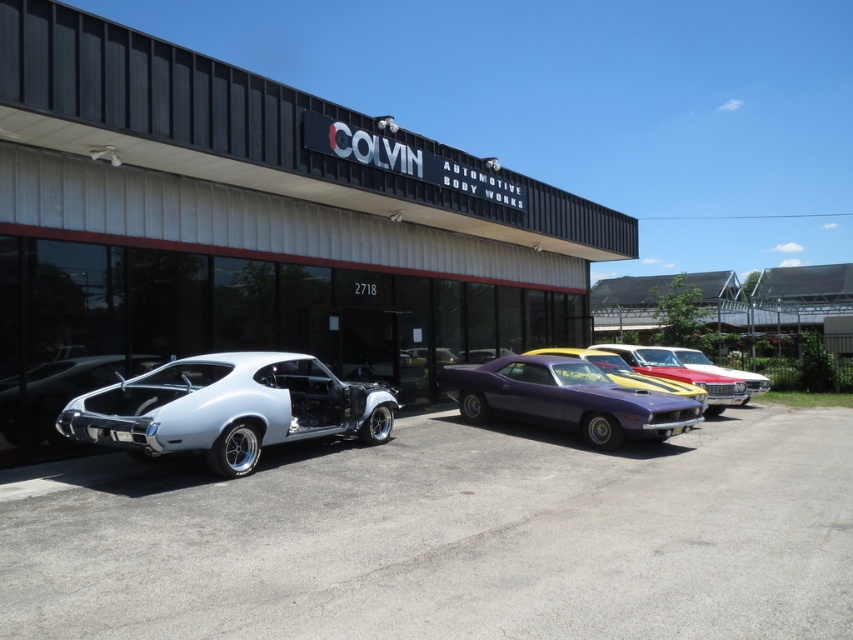
Question: Is chrome metallic car at center to the right of shiny metallic car at center from the viewer's perspective?

Choices:
 (A) yes
 (B) no

Answer: (B)

Question: Can you confirm if chrome metallic car at center is smaller than shiny metallic car at center?

Choices:
 (A) yes
 (B) no

Answer: (A)

Question: Which of these objects is positioned closest to the white metallic sports car at center?

Choices:
 (A) shiny metallic car at center
 (B) chrome metallic car at center
 (C) purple glossy muscle car at center

Answer: (B)

Question: Does purple glossy muscle car at center have a greater width compared to chrome metallic car at center?

Choices:
 (A) yes
 (B) no

Answer: (A)

Question: Which point appears closest to the camera in this image?

Choices:
 (A) (735, 376)
 (B) (720, 385)
 (C) (32, 385)

Answer: (C)

Question: Which object appears closest to the camera in this image?

Choices:
 (A) purple glossy muscle car at center
 (B) white metallic sports car at center

Answer: (B)